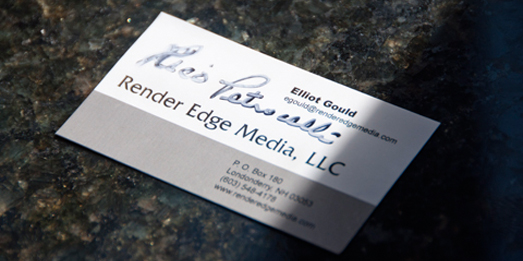
You are a GUI agent. You are given a task and a screenshot of the screen. Output one action in this format:
    pyautogui.click(x=<x>, y=<y>)
    Task: Click on the granite countertop
    The height and width of the screenshot is (261, 523).
    Given the screenshot: What is the action you would take?
    pyautogui.click(x=347, y=59)